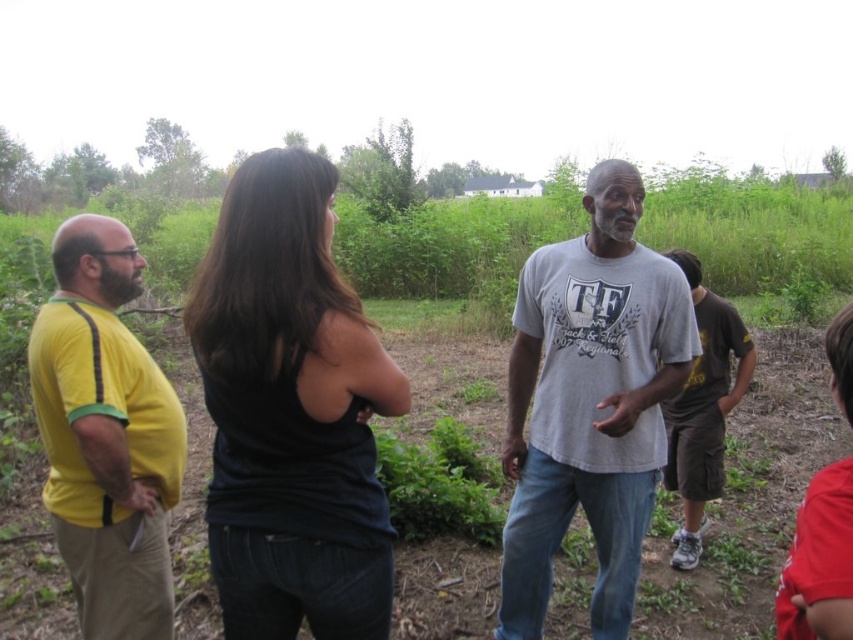
Does black matte tank top at center have a lesser height compared to gray cotton t-shirt at center?

Correct, black matte tank top at center is not as tall as gray cotton t-shirt at center.

Is point (296, 348) less distant than point (590, 200)?

Yes, point (296, 348) is closer to viewer.

This screenshot has width=853, height=640. What are the coordinates of `black matte tank top at center` in the screenshot? It's located at (291, 412).

Is black matte tank top at center bigger than yellow cotton shirt at left?

Yes.

Which is below, black matte tank top at center or yellow cotton shirt at left?

black matte tank top at center

This screenshot has width=853, height=640. Describe the element at coordinates (291, 412) in the screenshot. I see `black matte tank top at center` at that location.

Locate an element on the screen. The width and height of the screenshot is (853, 640). black matte tank top at center is located at coordinates (291, 412).

Which is in front, point (521, 502) or point (103, 362)?

Point (103, 362) is in front.

Does gray cotton t-shirt at center lie in front of yellow cotton shirt at left?

No, gray cotton t-shirt at center is behind yellow cotton shirt at left.

Where is `gray cotton t-shirt at center`? gray cotton t-shirt at center is located at coordinates (590, 403).

I want to click on gray cotton t-shirt at center, so click(590, 403).